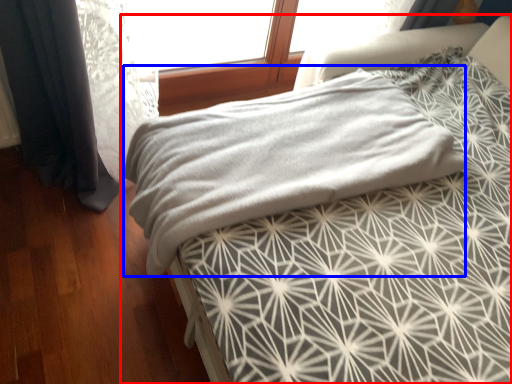
Question: Which point is further to the camera, bed (highlighted by a red box) or blanket (highlighted by a blue box)?

Choices:
 (A) bed
 (B) blanket

Answer: (B)